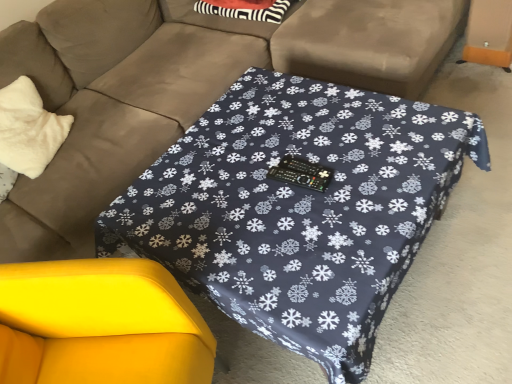
Question: Is yellow fabric swivel chair at lower left oriented towards dark blue fabric table at center?

Choices:
 (A) no
 (B) yes

Answer: (B)

Question: Does yellow fabric swivel chair at lower left have a smaller size compared to dark blue fabric table at center?

Choices:
 (A) no
 (B) yes

Answer: (B)

Question: Considering the relative sizes of yellow fabric swivel chair at lower left and dark blue fabric table at center in the image provided, is yellow fabric swivel chair at lower left taller than dark blue fabric table at center?

Choices:
 (A) yes
 (B) no

Answer: (A)

Question: Does yellow fabric swivel chair at lower left appear on the left side of dark blue fabric table at center?

Choices:
 (A) no
 (B) yes

Answer: (B)

Question: Is dark blue fabric table at center a part of yellow fabric swivel chair at lower left?

Choices:
 (A) yes
 (B) no

Answer: (B)

Question: Is the depth of yellow fabric swivel chair at lower left greater than that of dark blue fabric table at center?

Choices:
 (A) no
 (B) yes

Answer: (A)

Question: Is white fluffy pillow at left aimed at matte brown couch at center?

Choices:
 (A) yes
 (B) no

Answer: (A)

Question: Is white fluffy pillow at left far away from matte brown couch at center?

Choices:
 (A) no
 (B) yes

Answer: (A)

Question: Does white fluffy pillow at left have a lesser height compared to matte brown couch at center?

Choices:
 (A) yes
 (B) no

Answer: (A)

Question: Is white fluffy pillow at left not within matte brown couch at center?

Choices:
 (A) no
 (B) yes

Answer: (A)

Question: From the image's perspective, is white fluffy pillow at left located beneath matte brown couch at center?

Choices:
 (A) no
 (B) yes

Answer: (B)

Question: Does white fluffy pillow at left contain matte brown couch at center?

Choices:
 (A) yes
 (B) no

Answer: (B)

Question: Is matte brown couch at center far from white fluffy pillow at left?

Choices:
 (A) yes
 (B) no

Answer: (B)